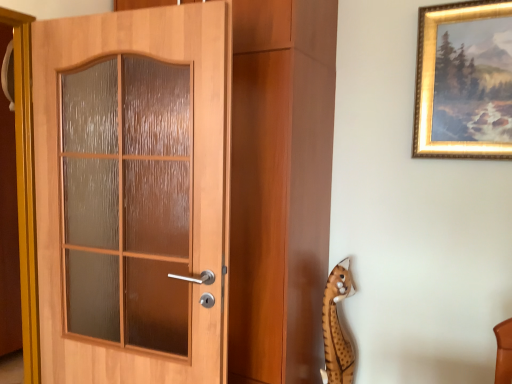
Question: From the image's perspective, does gold-framed painting at upper right appear lower than wooden door at left?

Choices:
 (A) yes
 (B) no

Answer: (B)

Question: Does gold-framed painting at upper right touch wooden door at left?

Choices:
 (A) yes
 (B) no

Answer: (B)

Question: Can you confirm if gold-framed painting at upper right is positioned to the left of wooden door at left?

Choices:
 (A) yes
 (B) no

Answer: (B)

Question: Is gold-framed painting at upper right aimed at wooden door at left?

Choices:
 (A) yes
 (B) no

Answer: (B)

Question: Is gold-framed painting at upper right facing away from wooden door at left?

Choices:
 (A) no
 (B) yes

Answer: (A)

Question: From their relative heights in the image, would you say gold-framed painting at upper right is taller or shorter than spotted plush toy at lower right?

Choices:
 (A) short
 (B) tall

Answer: (B)

Question: Considering their positions, is gold-framed painting at upper right located in front of or behind spotted plush toy at lower right?

Choices:
 (A) behind
 (B) front

Answer: (B)

Question: From the image's perspective, is gold-framed painting at upper right positioned above or below spotted plush toy at lower right?

Choices:
 (A) above
 (B) below

Answer: (A)

Question: In terms of size, does gold-framed painting at upper right appear bigger or smaller than spotted plush toy at lower right?

Choices:
 (A) big
 (B) small

Answer: (A)

Question: Considering the positions of point (446, 69) and point (182, 19), is point (446, 69) closer or farther from the camera than point (182, 19)?

Choices:
 (A) farther
 (B) closer

Answer: (A)

Question: From a real-world perspective, relative to wooden door at left, is gold-framed painting at upper right vertically above or below?

Choices:
 (A) below
 (B) above

Answer: (B)

Question: In terms of width, does gold-framed painting at upper right look wider or thinner when compared to wooden door at left?

Choices:
 (A) thin
 (B) wide

Answer: (A)

Question: In terms of height, does gold-framed painting at upper right look taller or shorter compared to wooden door at left?

Choices:
 (A) tall
 (B) short

Answer: (B)

Question: Would you say spotted plush toy at lower right is to the left or to the right of wooden door at left in the picture?

Choices:
 (A) right
 (B) left

Answer: (A)

Question: Considering the positions of spotted plush toy at lower right and wooden door at left in the image, is spotted plush toy at lower right bigger or smaller than wooden door at left?

Choices:
 (A) small
 (B) big

Answer: (A)